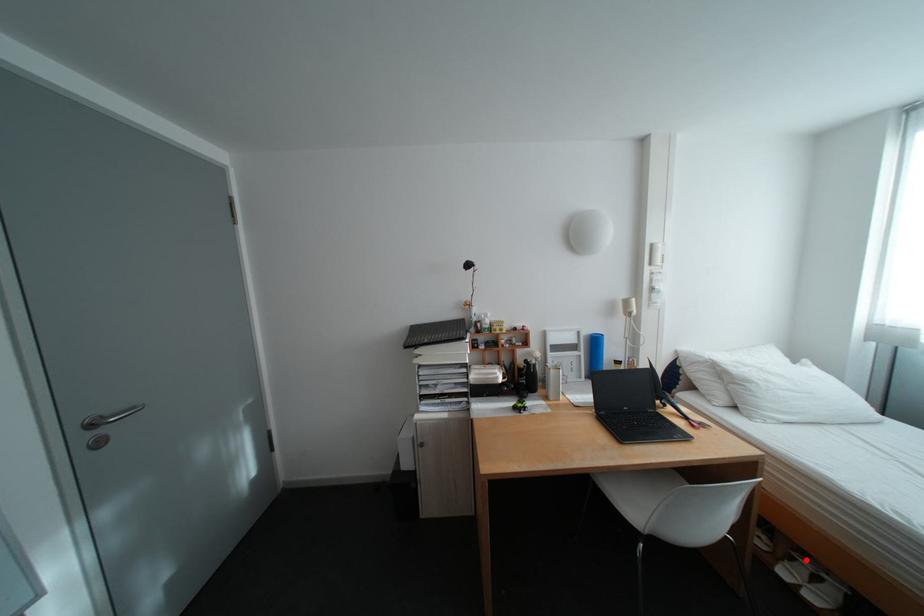
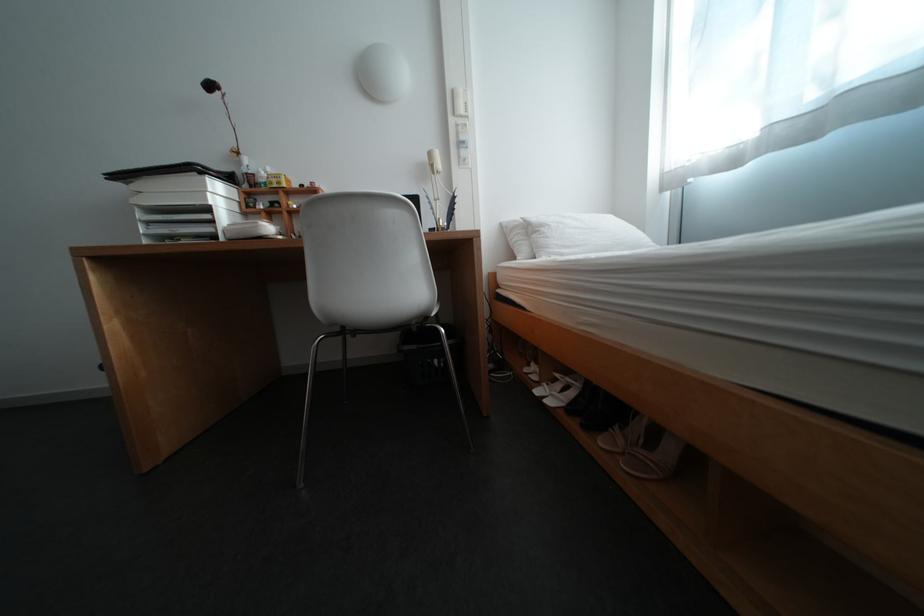
Locate, in the second image, the point that corresponds to the highlighted location in the first image.

(568, 381)